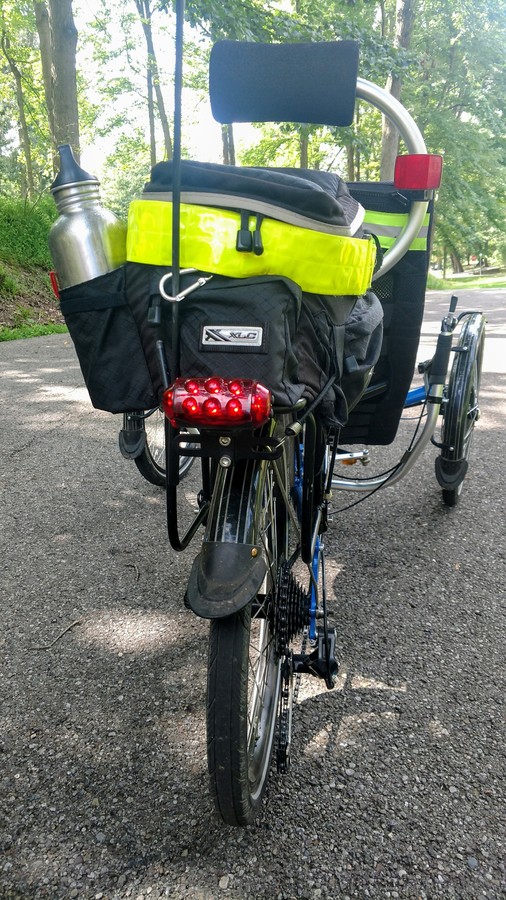
You are a GUI agent. You are given a task and a screenshot of the screen. Output one action in this format:
    pyautogui.click(x=<x>, y=<y>)
    Task: Click on the red lights
    This screenshot has width=506, height=900.
    Given the screenshot: What is the action you would take?
    pyautogui.click(x=214, y=393), pyautogui.click(x=417, y=175)